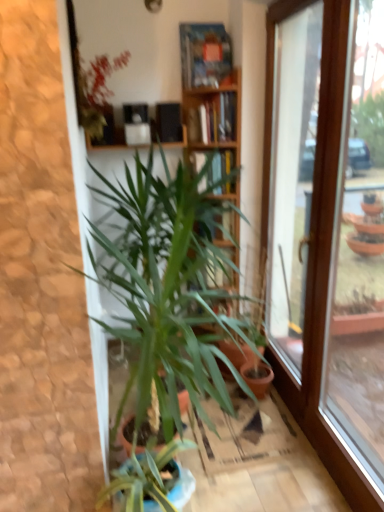
Question: Could you tell me if green leafy plant at center, arranged as the 2th houseplant when viewed from the top, is turned towards transparent glass window at right?

Choices:
 (A) no
 (B) yes

Answer: (B)

Question: Is green leafy plant at center, arranged as the 2th houseplant when viewed from the top, oriented away from transparent glass window at right?

Choices:
 (A) no
 (B) yes

Answer: (A)

Question: From the image's perspective, is green leafy plant at center, which is the 1th houseplant in bottom-to-top order, below transparent glass window at right?

Choices:
 (A) yes
 (B) no

Answer: (B)

Question: Does green leafy plant at center, arranged as the 2th houseplant when viewed from the top, have a lesser width compared to transparent glass window at right?

Choices:
 (A) yes
 (B) no

Answer: (B)

Question: From a real-world perspective, does green leafy plant at center, arranged as the 2th houseplant when viewed from the top, sit lower than transparent glass window at right?

Choices:
 (A) yes
 (B) no

Answer: (A)

Question: Considering the relative positions of green leafy plant at center, which is the 1th houseplant in bottom-to-top order, and transparent glass window at right in the image provided, is green leafy plant at center, which is the 1th houseplant in bottom-to-top order, to the left of transparent glass window at right from the viewer's perspective?

Choices:
 (A) no
 (B) yes

Answer: (B)

Question: From the image's perspective, does wooden bookcase at center appear higher than green leafy plant at center, arranged as the 2th houseplant when viewed from the top?

Choices:
 (A) yes
 (B) no

Answer: (A)

Question: Can you confirm if wooden bookcase at center is positioned to the right of green leafy plant at center, arranged as the 2th houseplant when viewed from the top?

Choices:
 (A) no
 (B) yes

Answer: (B)

Question: From the image's perspective, is wooden bookcase at center under green leafy plant at center, arranged as the 2th houseplant when viewed from the top?

Choices:
 (A) no
 (B) yes

Answer: (A)

Question: Is the depth of wooden bookcase at center less than that of green leafy plant at center, arranged as the 2th houseplant when viewed from the top?

Choices:
 (A) yes
 (B) no

Answer: (B)

Question: Is wooden bookcase at center outside of green leafy plant at center, arranged as the 2th houseplant when viewed from the top?

Choices:
 (A) no
 (B) yes

Answer: (A)

Question: Is wooden bookcase at center turned away from green leafy plant at center, arranged as the 2th houseplant when viewed from the top?

Choices:
 (A) no
 (B) yes

Answer: (B)

Question: Can you confirm if green leafy plant at center, which is the 1th houseplant in bottom-to-top order, is shorter than green leafy plant at upper left, which is the 2th houseplant from bottom to top?

Choices:
 (A) yes
 (B) no

Answer: (B)